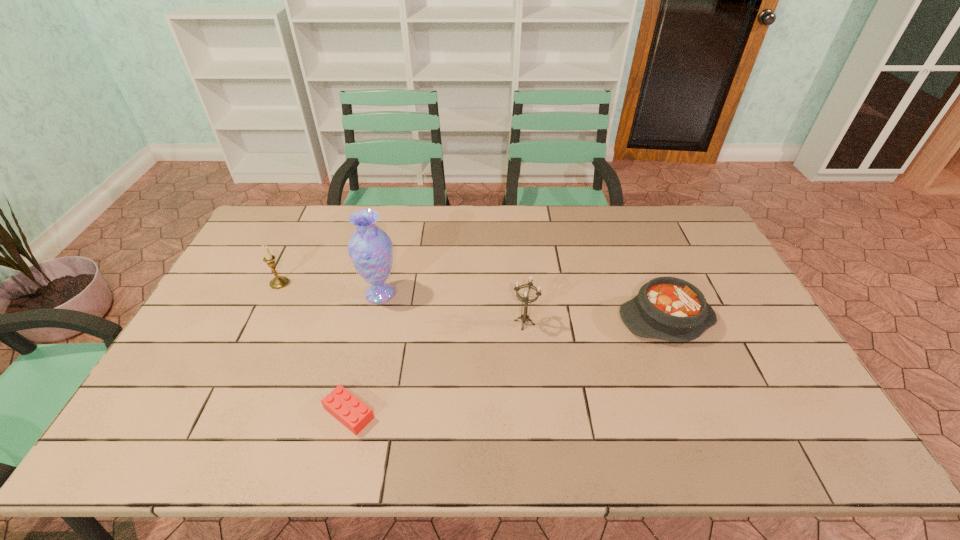
Where is `free space at the right edge of the desktop`? free space at the right edge of the desktop is located at coordinates (757, 360).

Find the location of `vacant area at the far left corner of the desktop`. vacant area at the far left corner of the desktop is located at coordinates pos(301,221).

Locate an element on the screen. The image size is (960, 540). free point at the near left corner is located at coordinates (185, 444).

Find the location of `unoccupied position between the right candle holder and the farther candle holder`. unoccupied position between the right candle holder and the farther candle holder is located at coordinates (402, 303).

The height and width of the screenshot is (540, 960). What are the coordinates of `free spot between the vase and the shortest object` in the screenshot? It's located at (365, 353).

Locate an element on the screen. This screenshot has width=960, height=540. free spot between the fourth tallest object and the vase is located at coordinates (523, 306).

In order to click on free space between the leftmost object and the fourth tallest object in this screenshot , I will do `click(472, 301)`.

Locate an element on the screen. This screenshot has width=960, height=540. vacant region between the rightmost object and the nearest object is located at coordinates (508, 366).

The width and height of the screenshot is (960, 540). I want to click on vacant space in between the nearest object and the farther candle holder, so click(x=314, y=348).

Identify the location of empty location between the nearer candle holder and the rightmost object. The width and height of the screenshot is (960, 540). (595, 321).